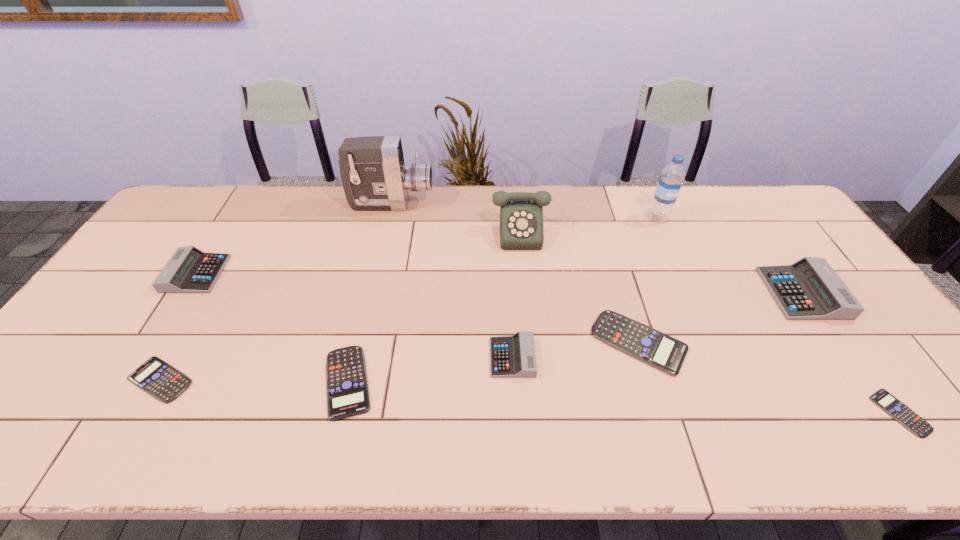
Find the location of a particular element. The height and width of the screenshot is (540, 960). telephone that is at the far edge is located at coordinates (521, 213).

I want to click on object positioned at the left edge, so click(190, 270).

At what (x,y) coordinates should I click in order to perform the action: click on object present at the near right corner. Please return your answer as a coordinate pair (x, y). The width and height of the screenshot is (960, 540). Looking at the image, I should click on (882, 398).

Locate an element on the screen. The image size is (960, 540). vacant space at the far edge of the desktop is located at coordinates (701, 224).

Image resolution: width=960 pixels, height=540 pixels. In the image, there is a desktop. In order to click on free region at the near edge in this screenshot , I will do `click(292, 419)`.

The height and width of the screenshot is (540, 960). What are the coordinates of `free location at the left edge` in the screenshot? It's located at (92, 321).

This screenshot has height=540, width=960. In the image, there is a desktop. Identify the location of vacant space at the right edge. (918, 396).

In the image, there is a desktop. At what (x,y) coordinates should I click in order to perform the action: click on free region at the far left corner. Please return your answer as a coordinate pair (x, y). Image resolution: width=960 pixels, height=540 pixels. Looking at the image, I should click on (228, 190).

You are a GUI agent. You are given a task and a screenshot of the screen. Output one action in this format:
    pyautogui.click(x=<x>, y=<y>)
    Task: Click on the free space that is in between the smallest gray calculator and the biggest gray calculator
    Image resolution: width=960 pixels, height=540 pixels.
    Given the screenshot: What is the action you would take?
    pyautogui.click(x=658, y=326)

Where is `free spot between the third calculator from left to right and the sixth shortest object`? The image size is (960, 540). free spot between the third calculator from left to right and the sixth shortest object is located at coordinates (272, 328).